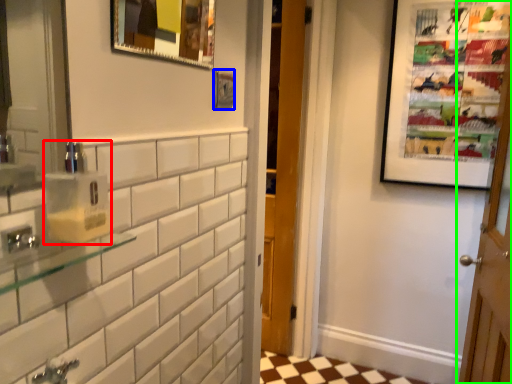
Question: Which object is the farthest from soap dispenser (highlighted by a red box)? Choose among these: picture frame (highlighted by a blue box) or door (highlighted by a green box).

Choices:
 (A) picture frame
 (B) door

Answer: (B)